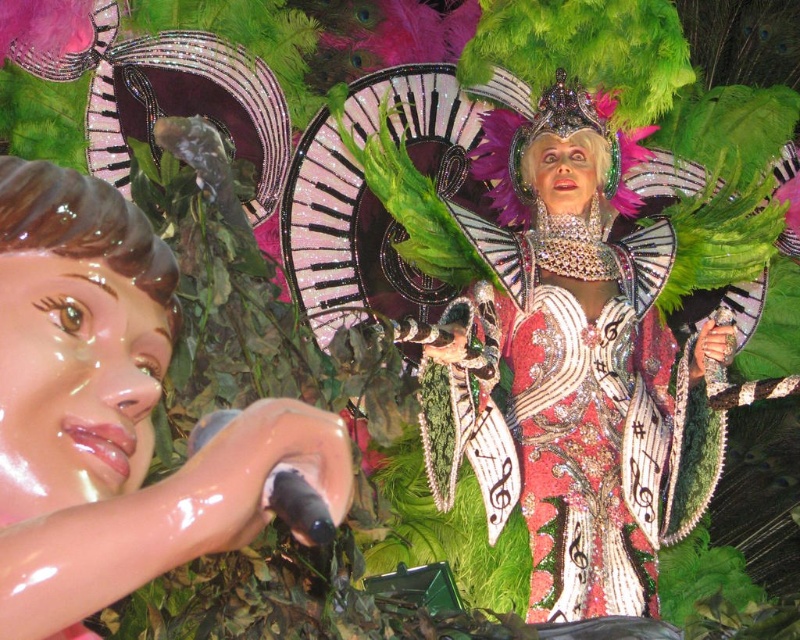
Question: Among these points, which one is farthest from the camera?

Choices:
 (A) (120, 316)
 (B) (558, 499)

Answer: (B)

Question: Does matte plastic doll at left have a larger size compared to shiny sequined dress at center?

Choices:
 (A) yes
 (B) no

Answer: (B)

Question: From the image, what is the correct spatial relationship of matte plastic doll at left in relation to shiny sequined dress at center?

Choices:
 (A) below
 (B) above

Answer: (B)

Question: Is matte plastic doll at left above shiny sequined dress at center?

Choices:
 (A) no
 (B) yes

Answer: (B)